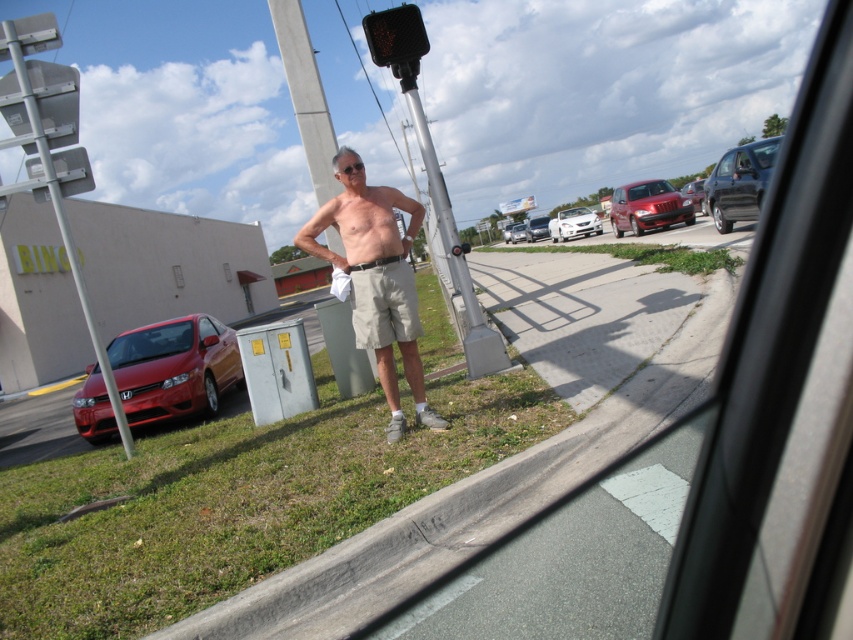
Between gray concrete curb at lower center and shiny red sedan at lower left, which one is positioned higher?

gray concrete curb at lower center is above.

Between gray concrete curb at lower center and shiny red sedan at lower left, which one appears on the right side from the viewer's perspective?

From the viewer's perspective, gray concrete curb at lower center appears more on the right side.

Is point (639, 388) positioned behind point (102, 410)?

No, it is in front of (102, 410).

The height and width of the screenshot is (640, 853). I want to click on gray concrete curb at lower center, so click(x=473, y=500).

Is point (692, 378) positioned after point (700, 179)?

That is False.

Is gray concrete curb at lower center above shiny red sedan at center right?

A: Actually, gray concrete curb at lower center is below shiny red sedan at center right.

Which is in front, point (473, 506) or point (701, 188)?

Point (473, 506) is more forward.

Find the location of a particular element. The image size is (853, 640). gray concrete curb at lower center is located at coordinates 473,500.

Can you confirm if skinny white muscle at center is positioned to the right of silver metallic sedan at center?

No, skinny white muscle at center is not to the right of silver metallic sedan at center.

Does skinny white muscle at center have a larger size compared to silver metallic sedan at center?

Actually, skinny white muscle at center might be smaller than silver metallic sedan at center.

The height and width of the screenshot is (640, 853). Identify the location of skinny white muscle at center. (366, 225).